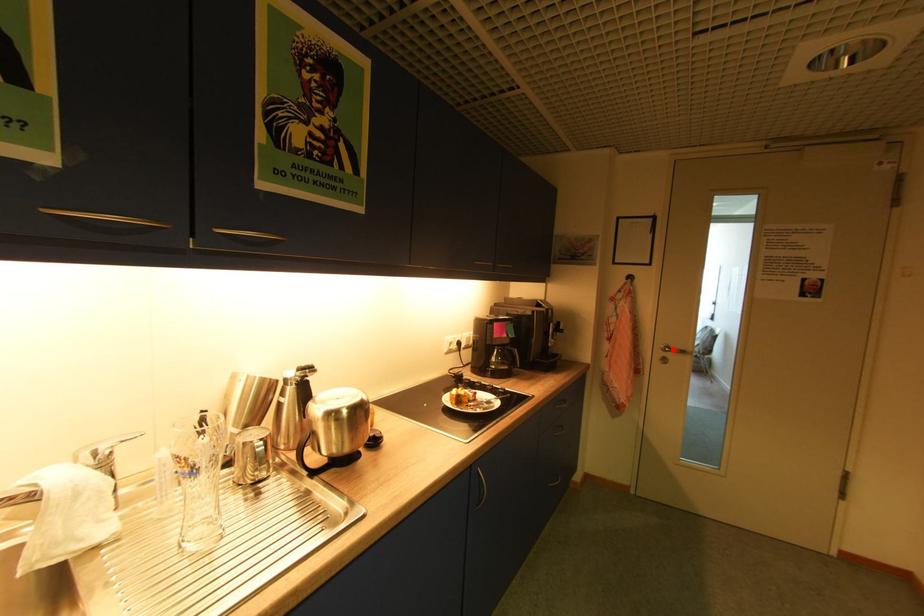
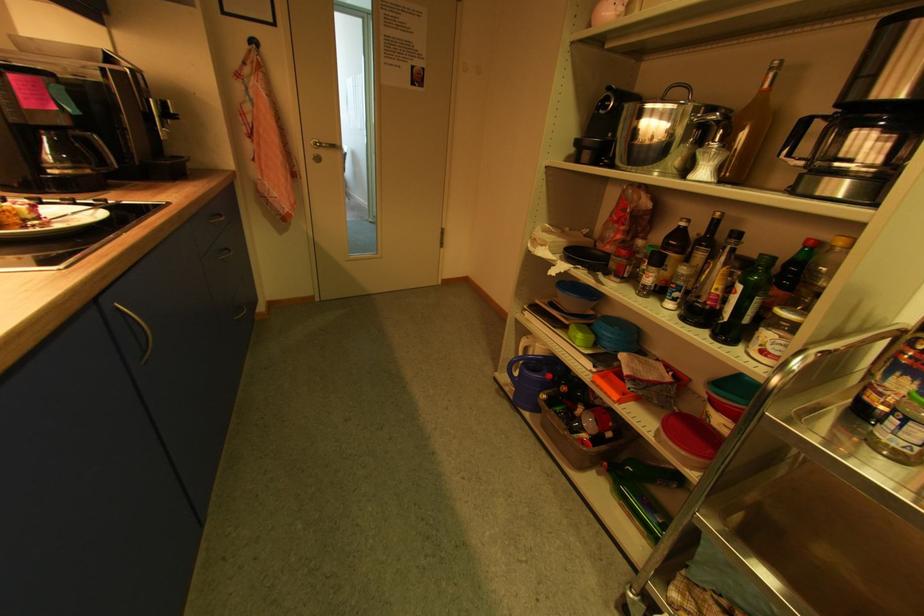
Question: I am providing you with two images of the same scene from different viewpoints. In image1, a red point is highlighted. Considering the same 3D point in image2, which of the following is correct?

Choices:
 (A) It is closer
 (B) It is farther

Answer: (A)